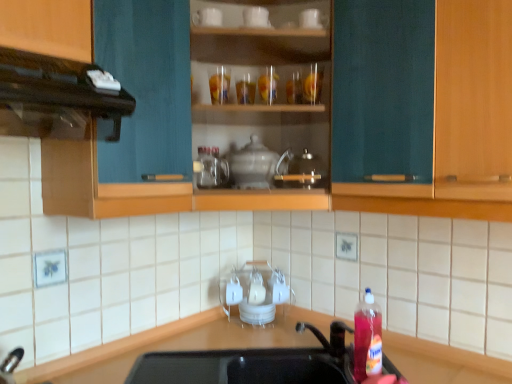
The image size is (512, 384). What do you see at coordinates (117, 347) in the screenshot? I see `black matte countertop at lower center` at bounding box center [117, 347].

The image size is (512, 384). Describe the element at coordinates (367, 338) in the screenshot. I see `translucent plastic bottle at lower right` at that location.

Identify the location of black matte vent at upper left. The image size is (512, 384). (55, 97).

Describe the element at coordinates (265, 103) in the screenshot. I see `matte glass cabinet at upper center` at that location.

What do you see at coordinates (268, 363) in the screenshot?
I see `black matte sink at lower center` at bounding box center [268, 363].

Locate an element on the screen. The image size is (512, 384). black matte countertop at lower center is located at coordinates (117, 347).

In the scene shown: How far apart are teal wood cabinet at center and black matte vent at upper left?

A distance of 78.19 centimeters exists between teal wood cabinet at center and black matte vent at upper left.

Identify the location of vent directly beneath the teal wood cabinet at center (from a real-world perspective). This screenshot has height=384, width=512. (55, 97).

Considering the relative positions of teal wood cabinet at center and black matte vent at upper left in the image provided, is teal wood cabinet at center to the right of black matte vent at upper left from the viewer's perspective?

Indeed, teal wood cabinet at center is positioned on the right side of black matte vent at upper left.

Which of these two, teal wood cabinet at center or black matte vent at upper left, is smaller?

Smaller between the two is black matte vent at upper left.

Which of these two, black matte countertop at lower center or black matte vent at upper left, is bigger?

black matte countertop at lower center is bigger.

Looking at this image, can you tell me how much black matte countertop at lower center and black matte vent at upper left differ in facing direction?

91.1 degrees separate the facing orientations of black matte countertop at lower center and black matte vent at upper left.

Locate an element on the screen. Image resolution: width=512 pixels, height=384 pixels. vent that appears on the left of black matte countertop at lower center is located at coordinates (55, 97).

Can you confirm if black matte countertop at lower center is taller than black matte vent at upper left?

Correct, black matte countertop at lower center is much taller as black matte vent at upper left.

Is black matte vent at upper left completely or partially inside white glossy teapot at center, the second appliance viewed from the top?

No, white glossy teapot at center, the second appliance viewed from the top, does not contain black matte vent at upper left.

How many degrees apart are the facing directions of white glossy teapot at center, the 1th appliance in the right-to-left sequence, and black matte vent at upper left?

45.5 degrees separate the facing orientations of white glossy teapot at center, the 1th appliance in the right-to-left sequence, and black matte vent at upper left.

Would you consider white glossy teapot at center, the second appliance viewed from the top, to be distant from black matte vent at upper left?

No, white glossy teapot at center, the second appliance viewed from the top, is in close proximity to black matte vent at upper left.

Does black matte vent at upper left have a greater width compared to black matte countertop at lower center?

Incorrect, the width of black matte vent at upper left does not surpass that of black matte countertop at lower center.

From the image's perspective, is black matte vent at upper left located above black matte countertop at lower center?

Indeed, from the image's perspective, black matte vent at upper left is shown above black matte countertop at lower center.

From the picture: Considering the relative sizes of black matte vent at upper left and black matte countertop at lower center in the image provided, is black matte vent at upper left smaller than black matte countertop at lower center?

Indeed, black matte vent at upper left has a smaller size compared to black matte countertop at lower center.

Consider the image. From a real-world perspective, is black matte vent at upper left positioned under black matte countertop at lower center based on gravity?

No, from a real-world perspective, black matte vent at upper left is not below black matte countertop at lower center.

The width and height of the screenshot is (512, 384). What are the coordinates of `bottle that appears below the black matte vent at upper left (from the image's perspective)` in the screenshot? It's located at (367, 338).

Based on the photo, considering the relative positions of translucent plastic bottle at lower right and black matte vent at upper left in the image provided, is translucent plastic bottle at lower right in front of black matte vent at upper left?

No, translucent plastic bottle at lower right is behind black matte vent at upper left.

Is black matte vent at upper left at the back of translucent plastic bottle at lower right?

No, black matte vent at upper left is not at the back of translucent plastic bottle at lower right.

Considering the relative sizes of translucent plastic bottle at lower right and black matte vent at upper left in the image provided, is translucent plastic bottle at lower right bigger than black matte vent at upper left?

Incorrect, translucent plastic bottle at lower right is not larger than black matte vent at upper left.

In the scene shown: Between black matte vent at upper left and white glossy teapot at center, the first appliance from the back, which one has smaller width?

white glossy teapot at center, the first appliance from the back, is thinner.

In the scene shown: From the image's perspective, relative to white glossy teapot at center, which appears as the first appliance when ordered from the bottom, is black matte vent at upper left above or below?

Based on their image positions, black matte vent at upper left is located above white glossy teapot at center, which appears as the first appliance when ordered from the bottom.

Considering the relative positions of black matte vent at upper left and white glossy teapot at center, which appears as the first appliance when ordered from the bottom, in the image provided, is black matte vent at upper left to the right of white glossy teapot at center, which appears as the first appliance when ordered from the bottom, from the viewer's perspective?

In fact, black matte vent at upper left is to the left of white glossy teapot at center, which appears as the first appliance when ordered from the bottom.

From the image's perspective, does black matte countertop at lower center appear higher than teal wood cabinet at center?

No.

Would you consider black matte countertop at lower center to be distant from teal wood cabinet at center?

Indeed, black matte countertop at lower center is not near teal wood cabinet at center.

Between black matte countertop at lower center and teal wood cabinet at center, which one has larger size?

With larger size is black matte countertop at lower center.

In order to click on cabinetry on the right of black matte vent at upper left in this screenshot , I will do `click(458, 121)`.

The width and height of the screenshot is (512, 384). In order to click on countertop in front of the black matte vent at upper left in this screenshot , I will do `click(117, 347)`.

When comparing their distances from teal wood cabinet at center, does black matte vent at upper left or white glossy teapot at center, which appears as the first appliance when ordered from the bottom, seem further?

The object further to teal wood cabinet at center is black matte vent at upper left.

When comparing their distances from black matte countertop at lower center, does black matte vent at upper left or matte glass cabinet at upper center seem closer?

Based on the image, black matte vent at upper left appears to be nearer to black matte countertop at lower center.

Looking at the image, which one is located further to black matte sink at lower center, translucent plastic bottle at lower right or white glossy teapot at center, the 1th appliance in the right-to-left sequence?

white glossy teapot at center, the 1th appliance in the right-to-left sequence, is further to black matte sink at lower center.

Estimate the real-world distances between objects in this image. Which object is closer to white glossy teapot at center, the 2th appliance viewed from the left, white ceramic mug at upper center, which is the second appliance from bottom to top, or teal wood cabinet at center?

Among the two, white ceramic mug at upper center, which is the second appliance from bottom to top, is located nearer to white glossy teapot at center, the 2th appliance viewed from the left.

Looking at the image, which one is located further to matte glass cabinet at upper center, white ceramic mug at upper center, marked as the first appliance in a left-to-right arrangement, or white glossy teapot at center, the second appliance viewed from the top?

The object further to matte glass cabinet at upper center is white ceramic mug at upper center, marked as the first appliance in a left-to-right arrangement.

Estimate the real-world distances between objects in this image. Which object is further from teal wood cabinet at center, white glossy teapot at center, the first appliance from the back, or matte glass cabinet at upper center?

Among the two, white glossy teapot at center, the first appliance from the back, is located further to teal wood cabinet at center.

Estimate the real-world distances between objects in this image. Which object is further from white glossy teapot at center, the second appliance viewed from the front, white ceramic mug at upper center, marked as the first appliance in a left-to-right arrangement, or black matte sink at lower center?

black matte sink at lower center is further to white glossy teapot at center, the second appliance viewed from the front.

Based on their spatial positions, is translucent plastic bottle at lower right or black matte sink at lower center closer to teal wood cabinet at center?

translucent plastic bottle at lower right lies closer to teal wood cabinet at center than the other object.

Where is `bottle between teal wood cabinet at center and black matte countertop at lower center from top to bottom`? Image resolution: width=512 pixels, height=384 pixels. bottle between teal wood cabinet at center and black matte countertop at lower center from top to bottom is located at coordinates (367, 338).

This screenshot has height=384, width=512. I want to click on vent between matte glass cabinet at upper center and black matte sink at lower center from top to bottom, so click(55, 97).

Identify the location of bottle between matte glass cabinet at upper center and black matte countertop at lower center in the up-down direction. Image resolution: width=512 pixels, height=384 pixels. (367, 338).

The height and width of the screenshot is (384, 512). I want to click on bottle between teal wood cabinet at center and black matte sink at lower center in the vertical direction, so pyautogui.click(x=367, y=338).